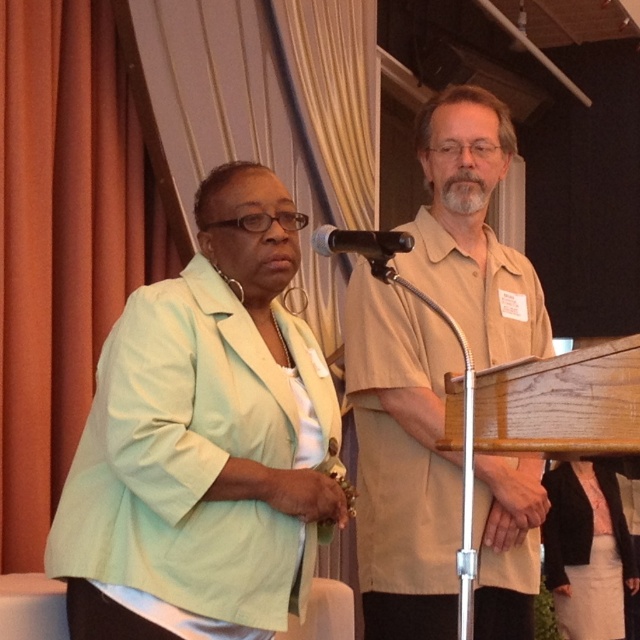
You are organizing a photo shoot and need to ensure that the light green fabric jacket at left and the beige shirt at center are visible in the frame. Based on their positions and sizes, which one might require more space in the camera frame to capture fully?

The light green fabric jacket at left might require more space in the camera frame because it is wider than the beige shirt at center.

You are organizing a photo shoot and need to arrange two models wearing the light green fabric jacket at left and beige shirt at center. Based on their heights, which model should stand in front to ensure both are visible in the photo?

The light green fabric jacket at left has a lesser height compared to beige shirt at center, so the shorter model wearing the light green fabric jacket at left should stand in front to ensure both are visible in the photo.